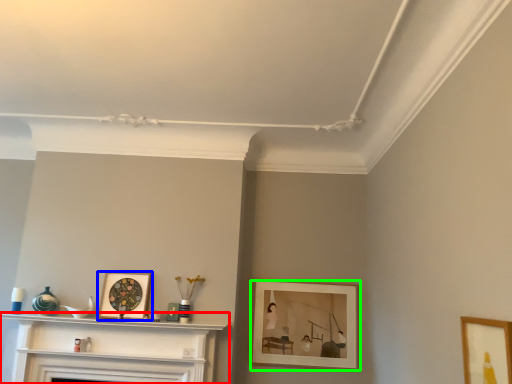
Question: Which is farther away from shelf (highlighted by a red box)? picture frame (highlighted by a blue box) or picture frame (highlighted by a green box)?

Choices:
 (A) picture frame
 (B) picture frame

Answer: (B)